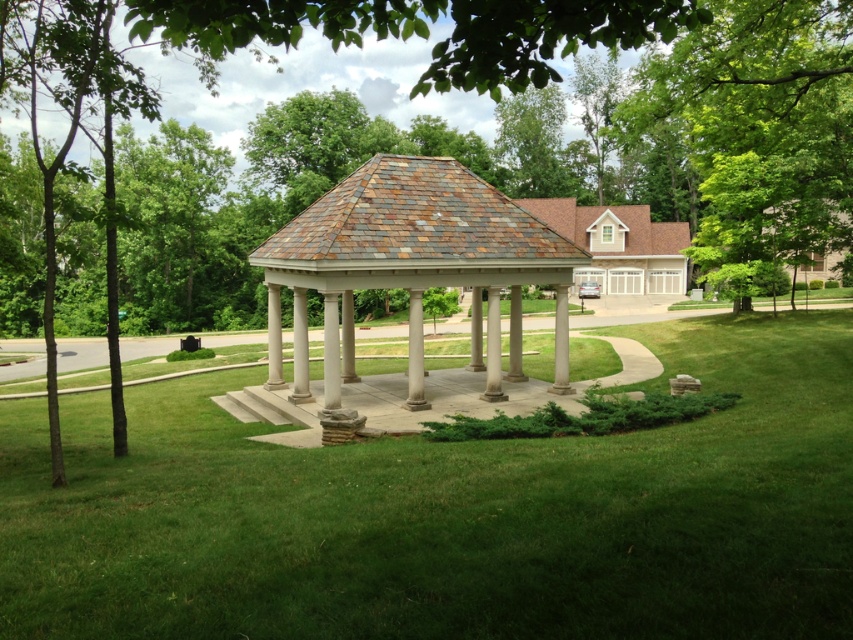
Is white stone gazebo at center above rustic shingles gazebo at center?

No, white stone gazebo at center is not above rustic shingles gazebo at center.

Between white stone gazebo at center and rustic shingles gazebo at center, which one is positioned higher?

rustic shingles gazebo at center is above.

Locate an element on the screen. The image size is (853, 640). white stone gazebo at center is located at coordinates (451, 513).

Is point (506, 205) closer to camera compared to point (634, 212)?

Yes, it is in front of point (634, 212).

Does rustic shingles gazebo at center appear on the left side of brown shingles gazebo at upper right?

Correct, you'll find rustic shingles gazebo at center to the left of brown shingles gazebo at upper right.

Is point (398, 209) positioned after point (637, 227)?

No, (398, 209) is in front of (637, 227).

Find the location of a particular element. rustic shingles gazebo at center is located at coordinates (410, 268).

Can you confirm if white stone gazebo at center is thinner than brown shingles gazebo at upper right?

No, white stone gazebo at center is not thinner than brown shingles gazebo at upper right.

Does white stone gazebo at center have a greater width compared to brown shingles gazebo at upper right?

Yes, white stone gazebo at center is wider than brown shingles gazebo at upper right.

Image resolution: width=853 pixels, height=640 pixels. I want to click on white stone gazebo at center, so click(451, 513).